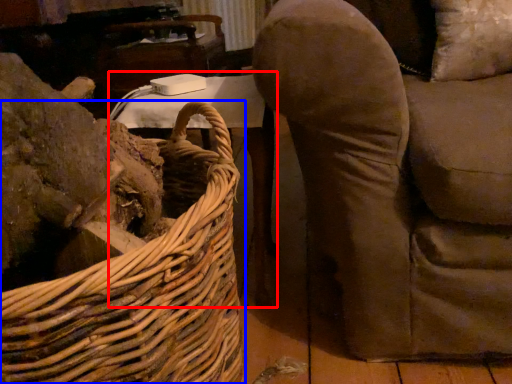
Question: Which point is closer to the camera, table (highlighted by a red box) or picnic basket (highlighted by a blue box)?

Choices:
 (A) table
 (B) picnic basket

Answer: (B)